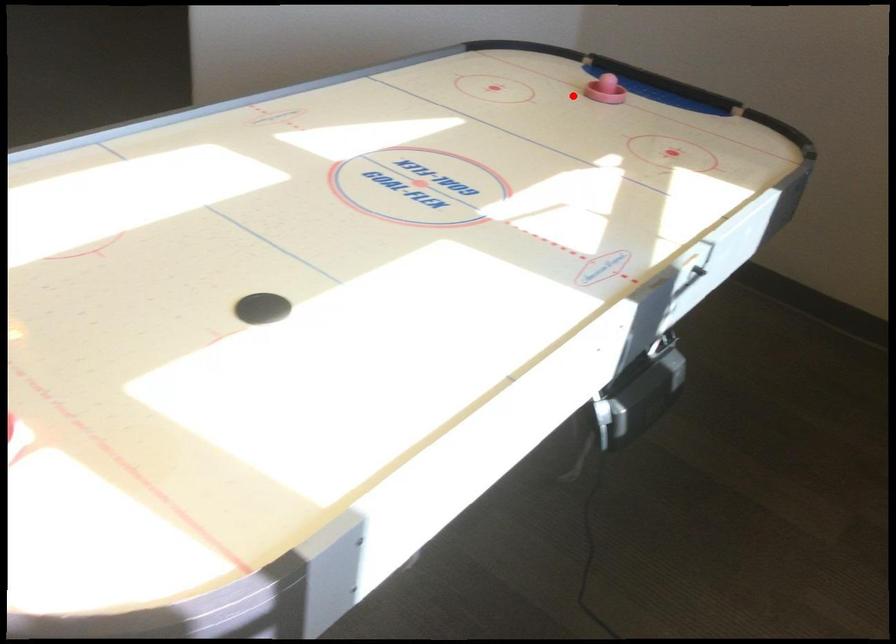
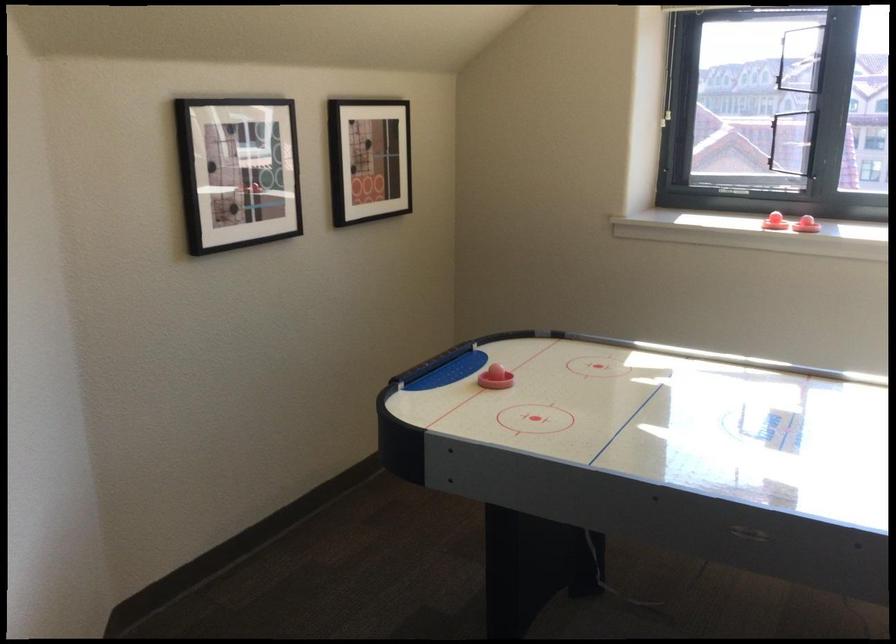
Find the pixel in the second image that matches the highlighted location in the first image.

(495, 379)